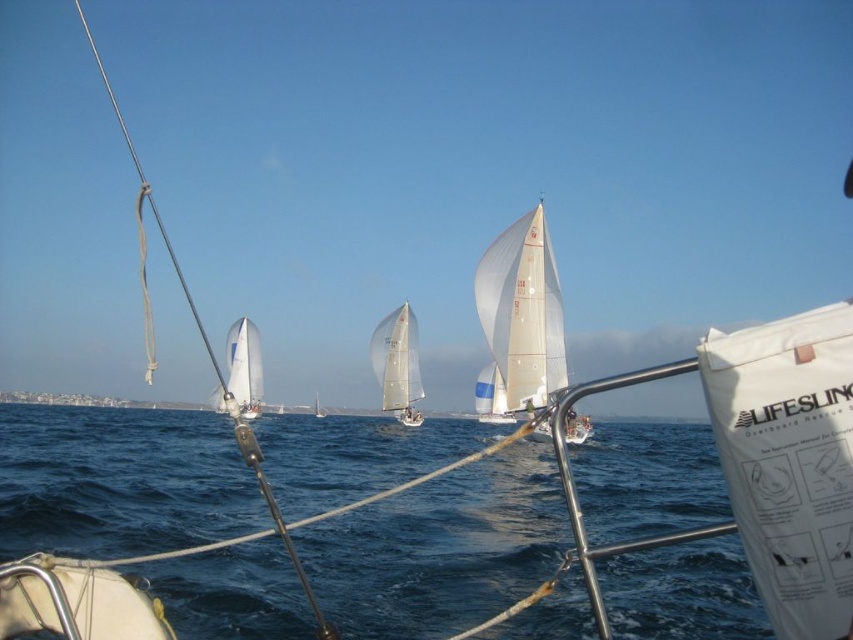
Question: Based on their relative distances, which object is nearer to the white sail at center?

Choices:
 (A) white sailboat at left
 (B) blue water at center

Answer: (A)

Question: Estimate the real-world distances between objects in this image. Which object is farther from the blue water at center?

Choices:
 (A) white sailboat at left
 (B) white sail at center
 (C) transparent sailboat at center
 (D) white sailboat at center

Answer: (B)

Question: Which point is farther from the camera taking this photo?

Choices:
 (A) (323, 417)
 (B) (509, 323)

Answer: (A)

Question: Does white sailboat at left have a smaller size compared to white sail at center?

Choices:
 (A) no
 (B) yes

Answer: (A)

Question: Is transparent sailboat at center below white sail at center?

Choices:
 (A) no
 (B) yes

Answer: (A)

Question: Can you confirm if blue water at center is wider than white sail at center?

Choices:
 (A) yes
 (B) no

Answer: (A)